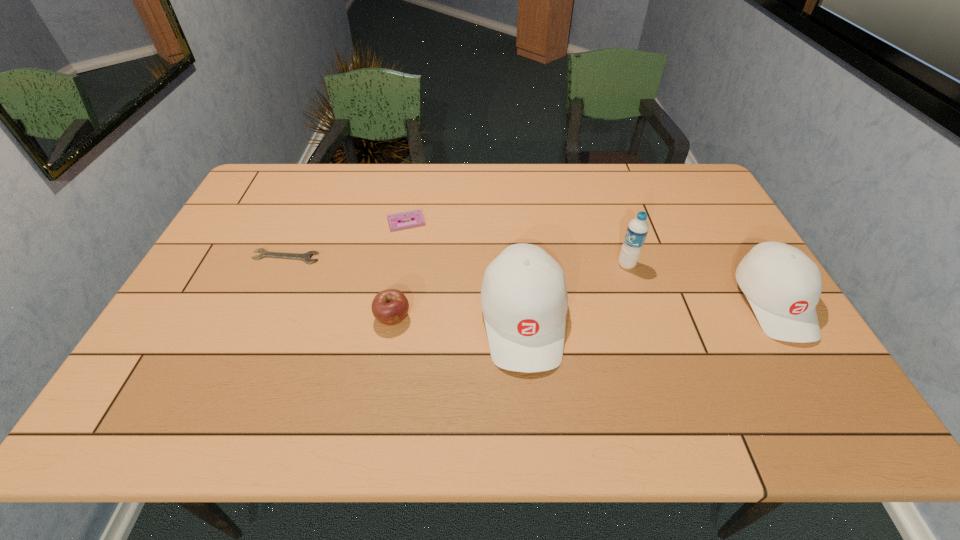
This screenshot has width=960, height=540. Identify the location of the taller baseball cap. (x=524, y=300).

Locate an element on the screen. This screenshot has width=960, height=540. the left baseball cap is located at coordinates (524, 300).

Find the location of a particular element. the shorter baseball cap is located at coordinates (783, 285).

This screenshot has width=960, height=540. I want to click on the third tallest object, so click(x=783, y=285).

Identify the location of videotape. The height and width of the screenshot is (540, 960). (395, 222).

Find the location of a particular element. Image resolution: width=960 pixels, height=540 pixels. the farthest object is located at coordinates (395, 222).

At what (x,y) coordinates should I click in order to perform the action: click on water bottle. Please return your answer as a coordinate pair (x, y). Looking at the image, I should click on (637, 230).

I want to click on the shortest object, so click(x=306, y=257).

This screenshot has width=960, height=540. Find the location of `wrench`. wrench is located at coordinates (306, 257).

Where is `apple`? apple is located at coordinates (390, 306).